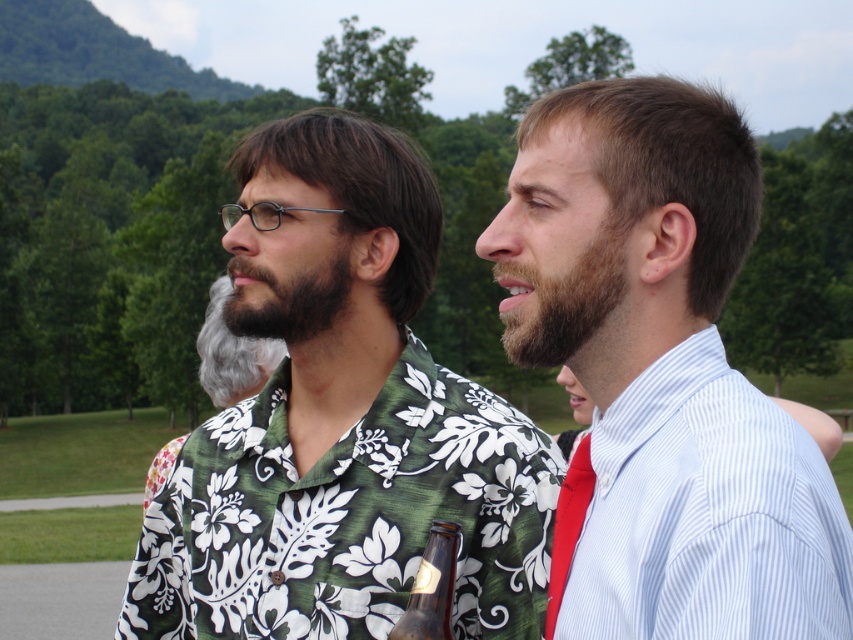
Who is lower down, white striped dress shirt at right or dark brown fuzzy beard at center?

Positioned lower is white striped dress shirt at right.

Does point (596, 570) lie in front of point (291, 333)?

Yes, it is.

Where is `white striped dress shirt at right`? This screenshot has width=853, height=640. white striped dress shirt at right is located at coordinates (706, 515).

Which is above, dark brown fuzzy beard at center or gray beard at center?

Positioned higher is dark brown fuzzy beard at center.

Does dark brown fuzzy beard at center have a lesser height compared to gray beard at center?

Yes.

Does point (328, 275) come closer to viewer compared to point (224, 387)?

Yes, it is.

Locate an element on the screen. The width and height of the screenshot is (853, 640). dark brown fuzzy beard at center is located at coordinates (289, 300).

Between green floral shirt at center and gray beard at center, which one is positioned higher?

green floral shirt at center

Is green floral shirt at center bigger than gray beard at center?

No, green floral shirt at center is not bigger than gray beard at center.

Between point (366, 410) and point (219, 346), which one is positioned in front?

Point (366, 410) is in front.

I want to click on green floral shirt at center, so click(341, 420).